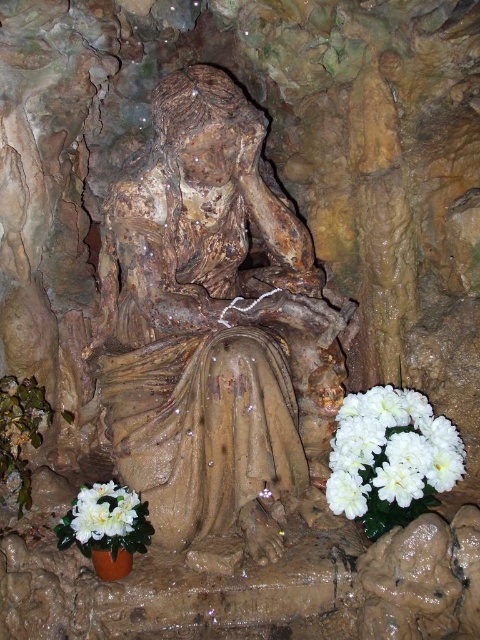
Measure the distance between white matte flower at lower right and camera.

The distance of white matte flower at lower right from camera is 4.61 feet.

Which of these two, white matte flower at lower right or white artificial flowers at lower left, stands taller?

With more height is white matte flower at lower right.

At what (x,y) coordinates should I click in order to perform the action: click on white matte flower at lower right. Please return your answer as a coordinate pair (x, y). Image resolution: width=480 pixels, height=640 pixels. Looking at the image, I should click on (391, 456).

The image size is (480, 640). What are the coordinates of `white matte flower at lower right` in the screenshot? It's located at (391, 456).

Is white matte flower at lower right behind white silk flower at lower left?

That is True.

Does point (377, 499) come farther from viewer compared to point (101, 524)?

Yes, point (377, 499) is behind point (101, 524).

Image resolution: width=480 pixels, height=640 pixels. I want to click on white matte flower at lower right, so point(391,456).

Which is behind, point (264, 138) or point (136, 525)?

The point (264, 138) is behind.

Describe the element at coordinates (214, 324) in the screenshot. The image size is (480, 640). I see `brown stone statue at center` at that location.

Locate an element on the screen. brown stone statue at center is located at coordinates (214, 324).